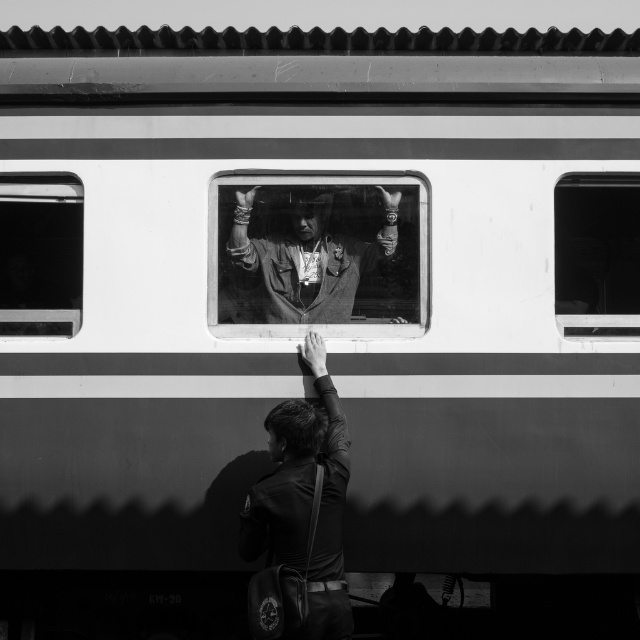
Measure the distance between matte leather jacket at center and transparent glass window at right.

matte leather jacket at center and transparent glass window at right are 3.55 feet apart.

Can you confirm if matte leather jacket at center is wider than transparent glass window at right?

Yes, matte leather jacket at center is wider than transparent glass window at right.

Image resolution: width=640 pixels, height=640 pixels. What do you see at coordinates (305, 260) in the screenshot? I see `matte leather jacket at center` at bounding box center [305, 260].

Image resolution: width=640 pixels, height=640 pixels. Find the location of `matte leather jacket at center`. matte leather jacket at center is located at coordinates (305, 260).

This screenshot has width=640, height=640. I want to click on matte leather jacket at center, so click(305, 260).

Can you confirm if matte leather jacket at center is shorter than transparent glass window at upper left?

No, matte leather jacket at center is not shorter than transparent glass window at upper left.

Locate an element on the screen. The width and height of the screenshot is (640, 640). matte leather jacket at center is located at coordinates (305, 260).

In the scene shown: Can you confirm if leather jacket at center is taller than transparent glass window at right?

Correct, leather jacket at center is much taller as transparent glass window at right.

Between leather jacket at center and transparent glass window at right, which one appears on the right side from the viewer's perspective?

transparent glass window at right is more to the right.

Locate an element on the screen. The image size is (640, 640). leather jacket at center is located at coordinates (305, 499).

At what (x,y) coordinates should I click in order to perform the action: click on leather jacket at center. Please return your answer as a coordinate pair (x, y). This screenshot has width=640, height=640. Looking at the image, I should click on (305, 499).